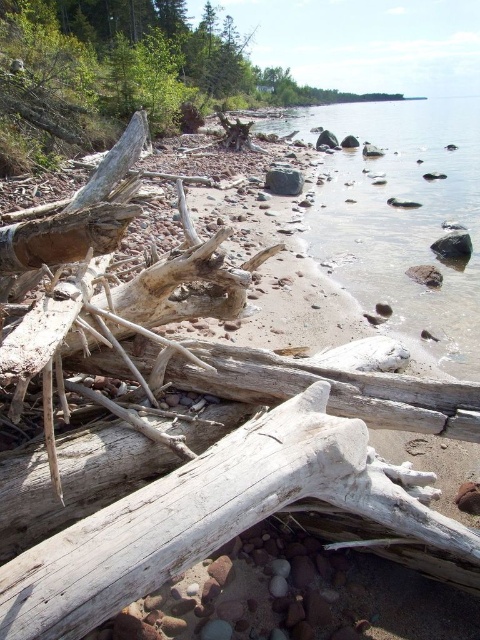
Is clear glass water at center below black smooth rock at center?

Actually, clear glass water at center is above black smooth rock at center.

Which of these two, clear glass water at center or black smooth rock at center, stands taller?

clear glass water at center is taller.

Where is `clear glass water at center`? clear glass water at center is located at coordinates (400, 214).

The height and width of the screenshot is (640, 480). In order to click on clear glass water at center in this screenshot , I will do `click(400, 214)`.